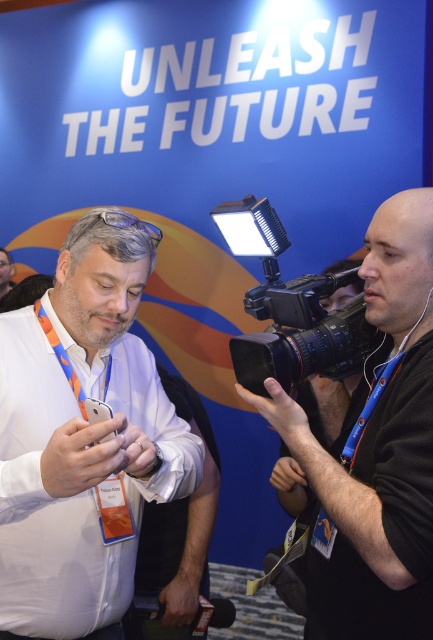
Question: Can you confirm if white matte shirt at center is positioned to the right of black plastic video camera at center?

Choices:
 (A) no
 (B) yes

Answer: (A)

Question: Does white matte shirt at center appear on the left side of black plastic video camera at center?

Choices:
 (A) no
 (B) yes

Answer: (B)

Question: Considering the real-world distances, which object is farthest from the black matte camera at center?

Choices:
 (A) black plastic video camera at center
 (B) white matte shirt at center

Answer: (B)

Question: Which point appears farthest from the camera in this image?

Choices:
 (A) (97, 557)
 (B) (361, 515)

Answer: (A)

Question: Which is farther from the black matte camera at center?

Choices:
 (A) black plastic video camera at center
 (B) white matte shirt at center

Answer: (B)

Question: Can you confirm if white matte shirt at center is positioned to the left of black matte camera at center?

Choices:
 (A) yes
 (B) no

Answer: (A)